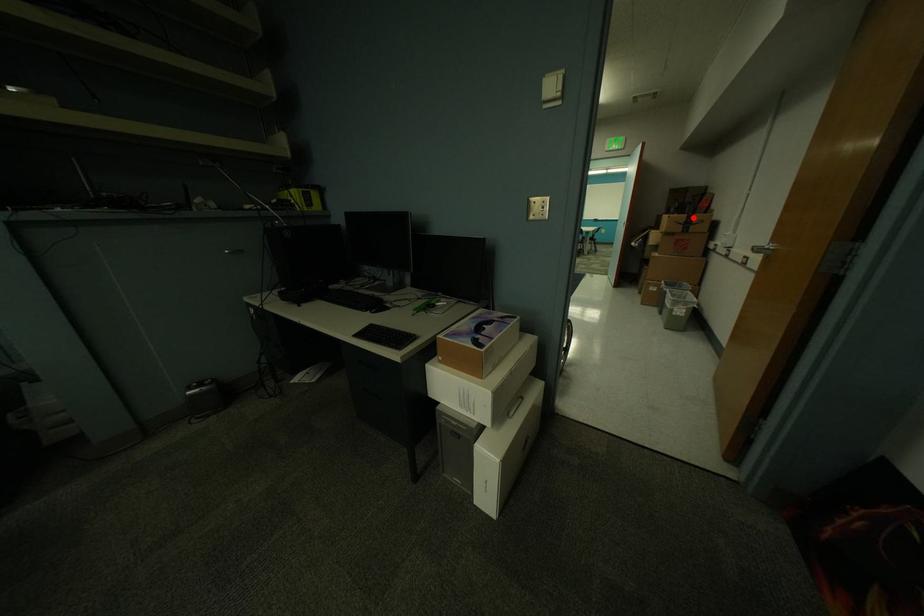
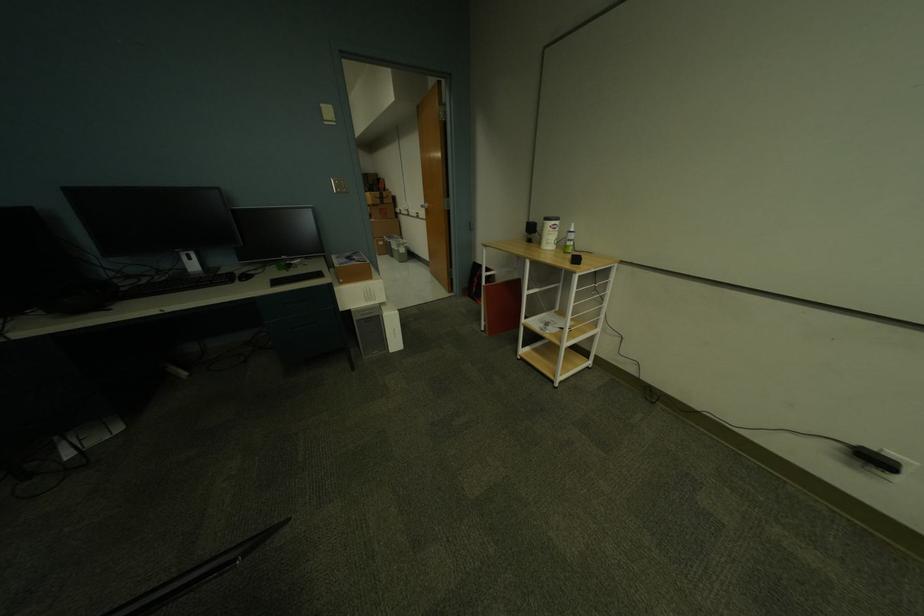
Question: I am providing you with two images of the same scene from different viewpoints. Given a red point in image1, look at the same physical point in image2. Is it:

Choices:
 (A) Closer to the viewpoint
 (B) Farther from the viewpoint

Answer: (A)